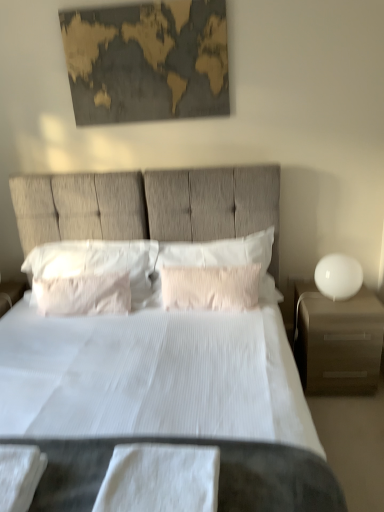
Identify the location of vacant space in front of white glossy sphere at right. This screenshot has height=512, width=384. (344, 308).